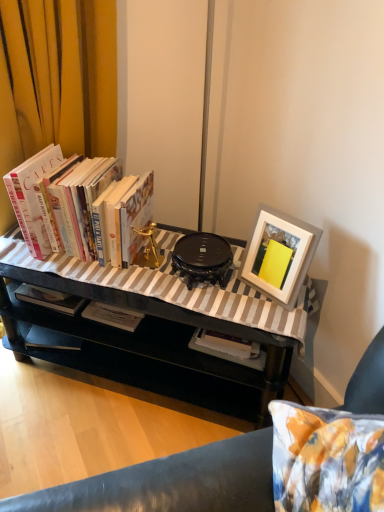
You are a GUI agent. You are given a task and a screenshot of the screen. Output one action in this format:
    pyautogui.click(x=<x>, y=<y>)
    Task: Click on the free space in front of hardcover books at left
    The height and width of the screenshot is (512, 384).
    Given the screenshot: What is the action you would take?
    pyautogui.click(x=102, y=283)